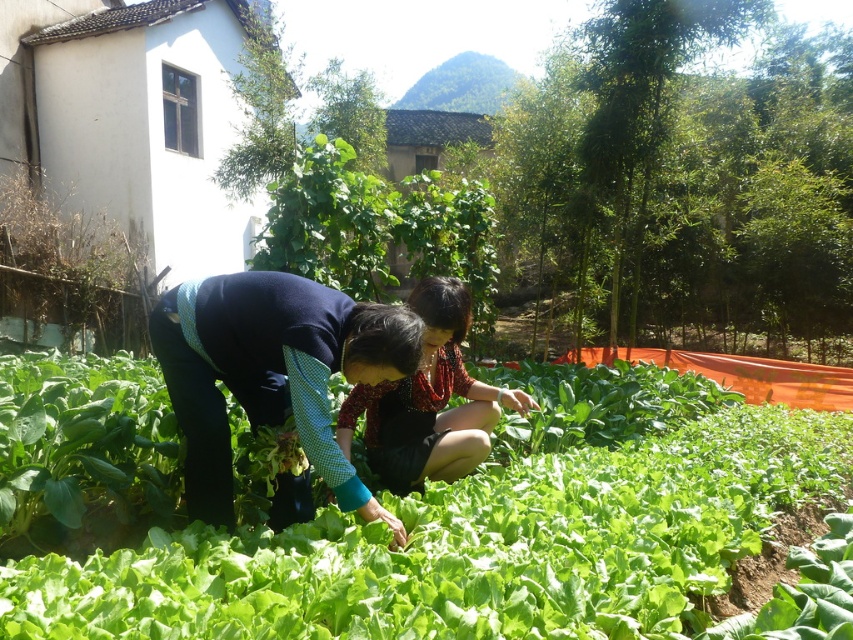
Can you confirm if dark blue fabric at center is shorter than reddish-brown fabric dress at center?

Correct, dark blue fabric at center is not as tall as reddish-brown fabric dress at center.

Does dark blue fabric at center appear on the right side of reddish-brown fabric dress at center?

Incorrect, dark blue fabric at center is not on the right side of reddish-brown fabric dress at center.

The width and height of the screenshot is (853, 640). In order to click on dark blue fabric at center in this screenshot , I will do pos(271,372).

At what (x,y) coordinates should I click in order to perform the action: click on dark blue fabric at center. Please return your answer as a coordinate pair (x, y). Image resolution: width=853 pixels, height=640 pixels. Looking at the image, I should click on (271, 372).

Is dark blue fabric at center behind green leafy vegetable at center?

That is False.

Who is more distant from viewer, (299, 346) or (657, 410)?

The point (657, 410) is behind.

Does point (228, 468) come farther from viewer compared to point (677, 371)?

No, (228, 468) is closer to viewer.

Image resolution: width=853 pixels, height=640 pixels. In order to click on dark blue fabric at center in this screenshot , I will do `click(271, 372)`.

Is green leafy vegetables at center to the right of reddish-brown fabric dress at center from the viewer's perspective?

Yes, green leafy vegetables at center is to the right of reddish-brown fabric dress at center.

Between point (689, 372) and point (468, 406), which one is positioned in front?

Positioned in front is point (468, 406).

At what (x,y) coordinates should I click in order to perform the action: click on green leafy vegetables at center. Please return your answer as a coordinate pair (x, y). This screenshot has width=853, height=640. Looking at the image, I should click on (480, 532).